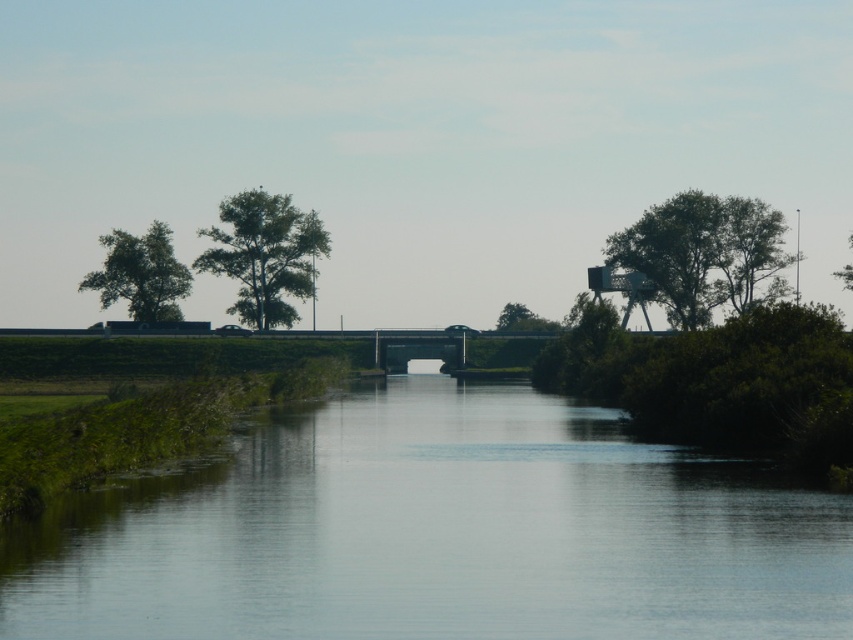
Which is behind, point (271, 276) or point (502, 328)?

The point (502, 328) is behind.

Is green leafy tree at upper center positioned at the back of green leafy tree at center?

That is False.

Where is `green leafy tree at upper center`? The height and width of the screenshot is (640, 853). green leafy tree at upper center is located at coordinates (264, 253).

Based on the photo, is clear water at center thinner than green leafy tree at left?

No.

Who is shorter, clear water at center or green leafy tree at left?

clear water at center

Where is `clear water at center`? clear water at center is located at coordinates (437, 532).

Locate an element on the screen. The height and width of the screenshot is (640, 853). clear water at center is located at coordinates (437, 532).

Based on the photo, between clear water at center and green leafy tree at upper right, which one is positioned higher?

green leafy tree at upper right is above.

Is point (653, 604) positioned in front of point (688, 253)?

Yes.

At what (x,y) coordinates should I click in order to perform the action: click on clear water at center. Please return your answer as a coordinate pair (x, y). The width and height of the screenshot is (853, 640). Looking at the image, I should click on (437, 532).